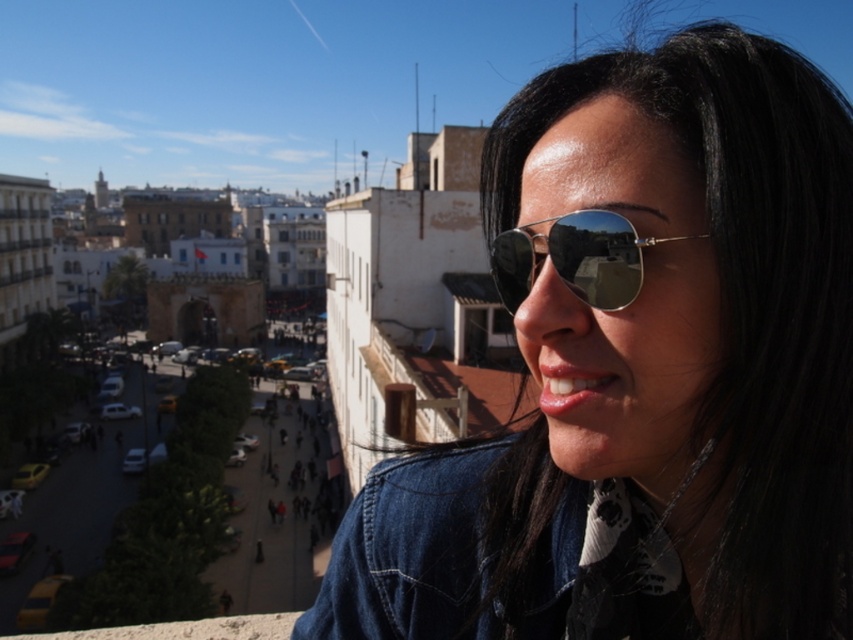
Question: Can you confirm if matte black sunglasses at upper right is positioned below denim jacket at lower right?

Choices:
 (A) no
 (B) yes

Answer: (A)

Question: Where is matte black sunglasses at upper right located in relation to silver reflective sunglasses at center in the image?

Choices:
 (A) below
 (B) above

Answer: (A)

Question: Does matte black sunglasses at upper right have a greater width compared to silver reflective sunglasses at center?

Choices:
 (A) no
 (B) yes

Answer: (B)

Question: Which point is farther to the camera?

Choices:
 (A) coord(815,404)
 (B) coord(577,228)
 (C) coord(334,561)

Answer: (C)

Question: Estimate the real-world distances between objects in this image. Which object is closer to the silver reflective sunglasses at center?

Choices:
 (A) matte black sunglasses at upper right
 (B) denim jacket at lower right

Answer: (A)

Question: Which point appears closest to the camera in this image?

Choices:
 (A) (595, 257)
 (B) (703, 506)

Answer: (A)